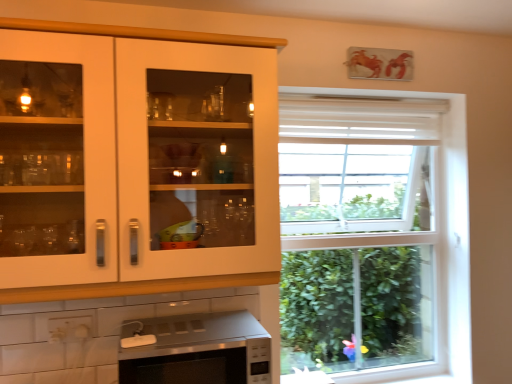
Question: Does satin silver microwave at lower center appear on the left side of white glossy cabinet at upper left?

Choices:
 (A) no
 (B) yes

Answer: (A)

Question: Is satin silver microwave at lower center placed right next to white glossy cabinet at upper left?

Choices:
 (A) no
 (B) yes

Answer: (A)

Question: Is satin silver microwave at lower center not close to white glossy cabinet at upper left?

Choices:
 (A) yes
 (B) no

Answer: (B)

Question: Is satin silver microwave at lower center closer to the viewer compared to white glossy cabinet at upper left?

Choices:
 (A) yes
 (B) no

Answer: (B)

Question: From a real-world perspective, is satin silver microwave at lower center over white glossy cabinet at upper left?

Choices:
 (A) yes
 (B) no

Answer: (B)

Question: Does satin silver microwave at lower center have a lesser height compared to white glossy cabinet at upper left?

Choices:
 (A) no
 (B) yes

Answer: (B)

Question: From a real-world perspective, is white glossy cabinet at upper left located higher than satin silver microwave at lower center?

Choices:
 (A) yes
 (B) no

Answer: (A)

Question: Can you confirm if white glossy cabinet at upper left is smaller than satin silver microwave at lower center?

Choices:
 (A) yes
 (B) no

Answer: (B)

Question: Is white glossy cabinet at upper left thinner than satin silver microwave at lower center?

Choices:
 (A) yes
 (B) no

Answer: (A)

Question: From the image's perspective, is white glossy cabinet at upper left above satin silver microwave at lower center?

Choices:
 (A) yes
 (B) no

Answer: (A)

Question: From a real-world perspective, is white glossy cabinet at upper left below satin silver microwave at lower center?

Choices:
 (A) no
 (B) yes

Answer: (A)

Question: Considering the relative sizes of white glossy cabinet at upper left and satin silver microwave at lower center in the image provided, is white glossy cabinet at upper left taller than satin silver microwave at lower center?

Choices:
 (A) no
 (B) yes

Answer: (B)

Question: Looking at their shapes, would you say satin silver microwave at lower center is wider or thinner than white glossy cabinet at upper left?

Choices:
 (A) thin
 (B) wide

Answer: (B)